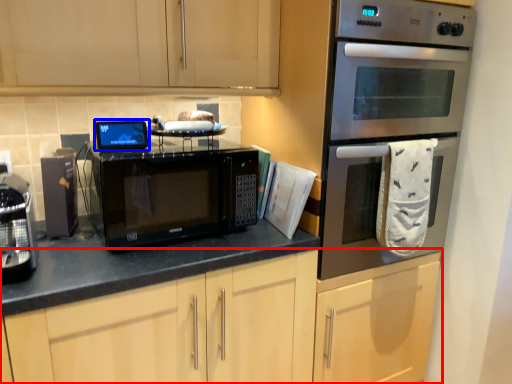
Question: Which of the following is the farthest to the observer, cabinetry (highlighted by a red box) or appliance (highlighted by a blue box)?

Choices:
 (A) cabinetry
 (B) appliance

Answer: (B)